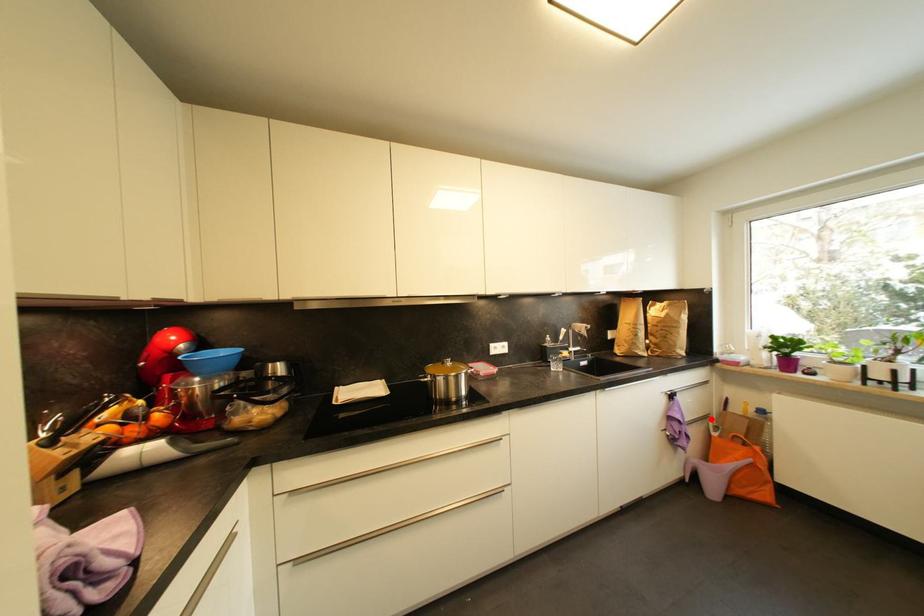
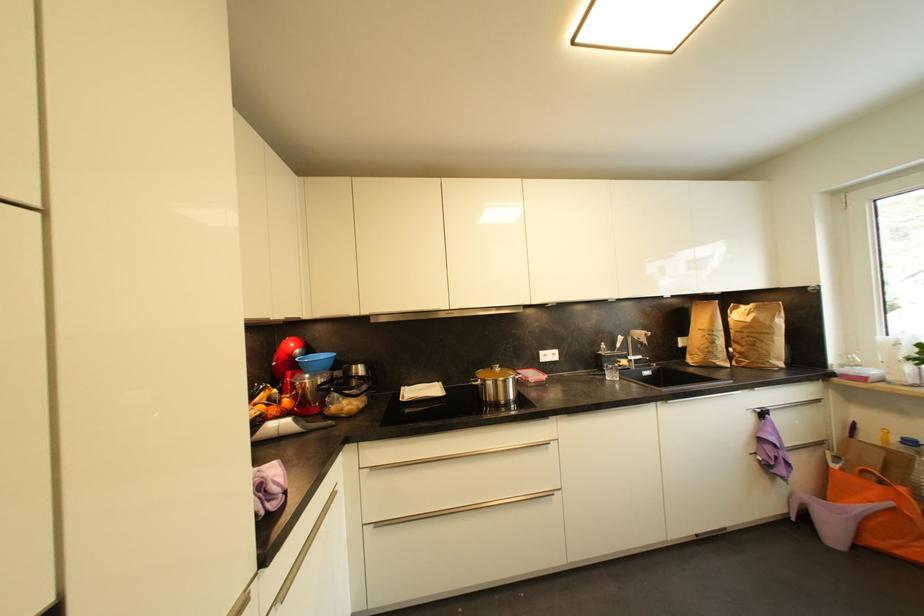
Find the pixel in the second image that matches the highlighted location in the first image.

(825, 446)